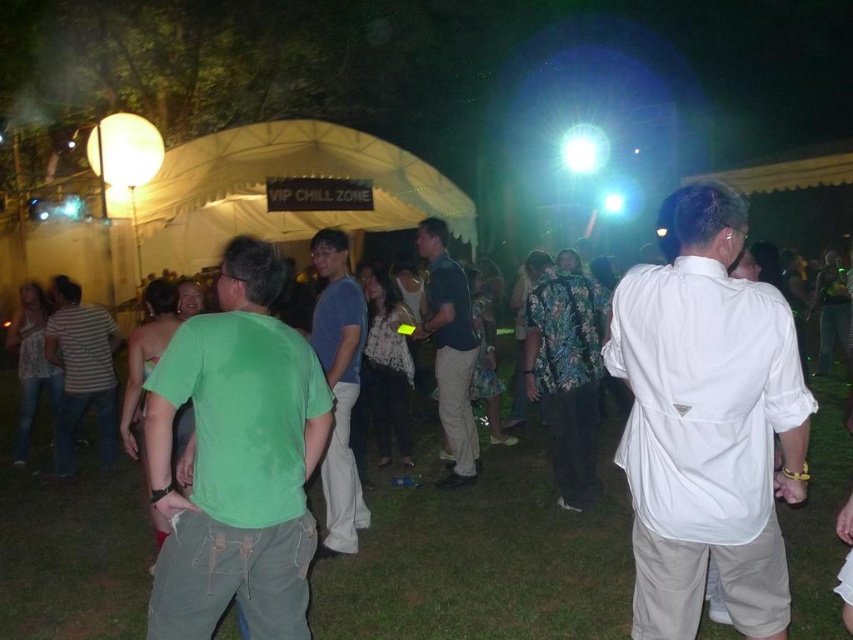
You are a GUI agent. You are given a task and a screenshot of the screen. Output one action in this format:
    pyautogui.click(x=<x>, y=<y>)
    Task: Click on the green cotton t-shirt at center
    
    Given the screenshot: What is the action you would take?
    pyautogui.click(x=236, y=460)

Which of these two, green cotton t-shirt at center or striped cotton shirt at center, stands taller?

With more height is striped cotton shirt at center.

Locate an element on the screen. This screenshot has width=853, height=640. green cotton t-shirt at center is located at coordinates (236, 460).

Is dark blue shirt at center positioned behind striped cotton shirt at center?

No, dark blue shirt at center is closer to the viewer.

Does dark blue shirt at center appear under striped cotton shirt at center?

Incorrect, dark blue shirt at center is not positioned below striped cotton shirt at center.

Between point (428, 264) and point (96, 384), which one is positioned behind?

The point (96, 384) is behind.

In order to click on dark blue shirt at center in this screenshot , I will do `click(450, 348)`.

Does point (788, 486) lie in front of point (437, 316)?

Yes, it is.

This screenshot has height=640, width=853. I want to click on white matte shirt at right, so click(706, 424).